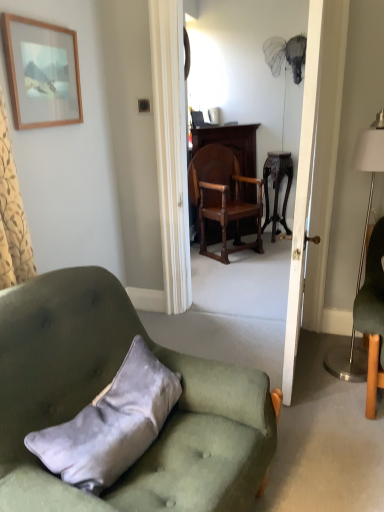
Question: Considering their positions, is white wooden door at center located in front of or behind wooden picture frame at upper left?

Choices:
 (A) behind
 (B) front

Answer: (B)

Question: Considering the positions of white wooden door at center and wooden picture frame at upper left in the image, is white wooden door at center taller or shorter than wooden picture frame at upper left?

Choices:
 (A) tall
 (B) short

Answer: (A)

Question: Estimate the real-world distances between objects in this image. Which object is farther from the dark wood stool at center?

Choices:
 (A) velvet green armchair at center, which is counted as the second chair, starting from the top
 (B) wooden picture frame at upper left
 (C) velvet gray pillow at lower left
 (D) silver metallic floor lamp at right
 (E) polished wood chair at center, acting as the 2th chair starting from the front

Answer: (C)

Question: Which is farther from the velvet gray pillow at lower left?

Choices:
 (A) wooden picture frame at upper left
 (B) white wooden door at center
 (C) dark wood stool at center
 (D) polished wood chair at center, acting as the 2th chair starting from the front
 (E) silver metallic floor lamp at right

Answer: (C)